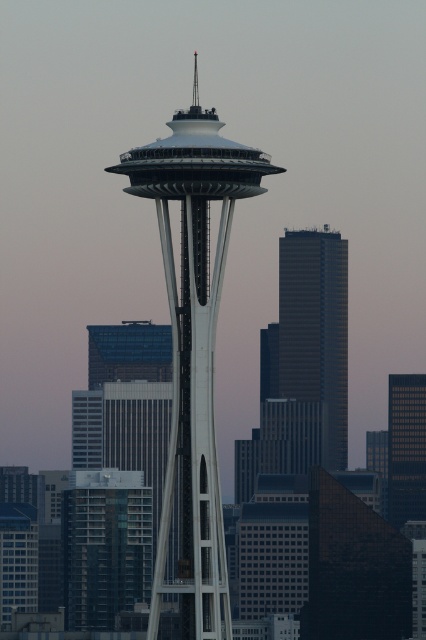
Question: Which of the following is the closest to the observer?

Choices:
 (A) white glass tower at center
 (B) smooth glass skyscraper at right
 (C) dark gray glass skyscraper at center

Answer: (A)

Question: Estimate the real-world distances between objects in this image. Which object is closer to the dark gray glass skyscraper at center?

Choices:
 (A) smooth glass skyscraper at right
 (B) white glass tower at center

Answer: (A)

Question: Which object is closer to the camera taking this photo?

Choices:
 (A) dark gray glass skyscraper at center
 (B) white glass tower at center

Answer: (B)

Question: Is white glass tower at center to the left of dark gray glass skyscraper at center from the viewer's perspective?

Choices:
 (A) yes
 (B) no

Answer: (A)

Question: Does dark gray glass skyscraper at center have a greater width compared to smooth glass skyscraper at right?

Choices:
 (A) yes
 (B) no

Answer: (A)

Question: Can you confirm if dark gray glass skyscraper at center is smaller than smooth glass skyscraper at right?

Choices:
 (A) no
 (B) yes

Answer: (A)